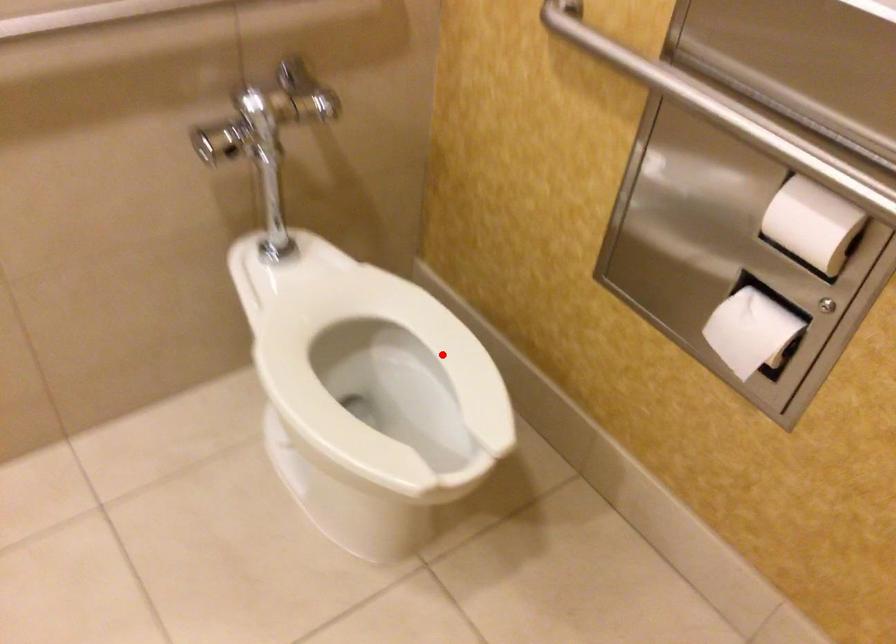
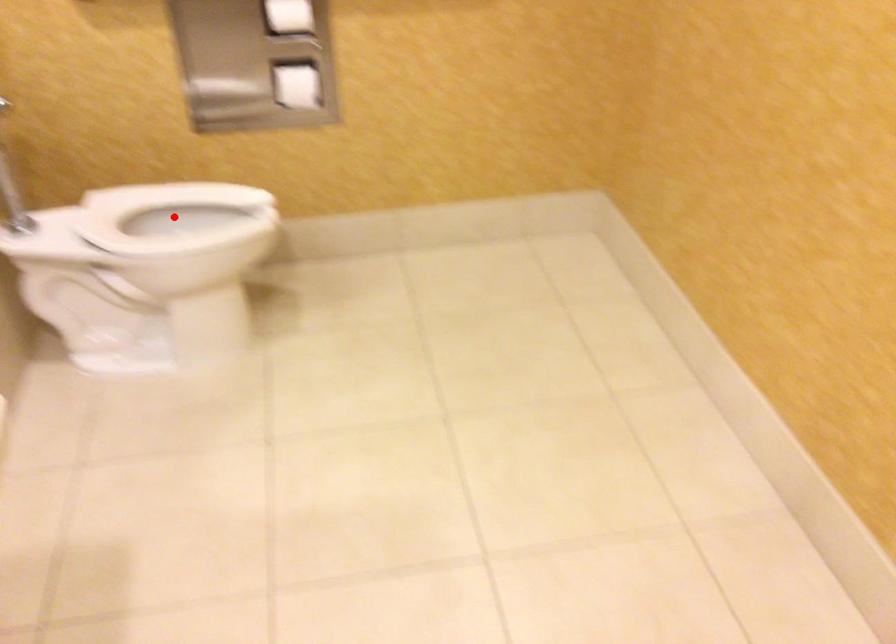
I am providing you with two images of the same scene from different viewpoints. A red point is marked on the first image and another point is marked on the second image. Do the highlighted points in image1 and image2 indicate the same real-world spot?

Yes